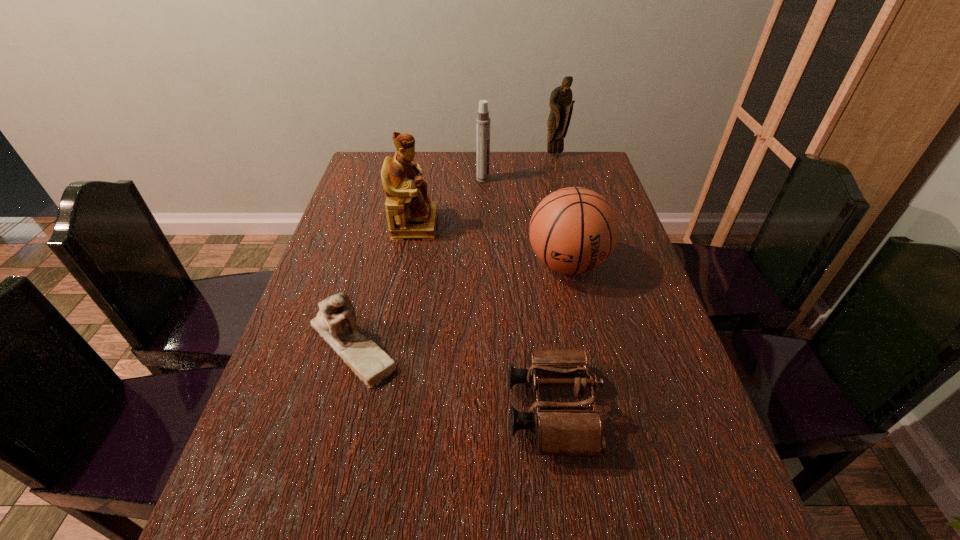
You are a GUI agent. You are given a task and a screenshot of the screen. Output one action in this format:
    pyautogui.click(x=<x>, y=<y>)
    Task: Click on the vacant space located on the front-facing side of the second farthest figurine
    
    Given the screenshot: What is the action you would take?
    pyautogui.click(x=457, y=224)

At what (x,y) coordinates should I click in order to perform the action: click on vacant space situated 0.170m on the left of the fourth object from right to left. Please return your answer as a coordinate pair (x, y). The image size is (960, 540). Looking at the image, I should click on (425, 179).

You are a GUI agent. You are given a task and a screenshot of the screen. Output one action in this format:
    pyautogui.click(x=<x>, y=<y>)
    Task: Click on the vacant space situated on the surface of the third shortest object near the brand logo
    The image size is (960, 540).
    Given the screenshot: What is the action you would take?
    pyautogui.click(x=607, y=447)

At what (x,y) coordinates should I click in order to perform the action: click on vacant position located on the front-facing side of the second shortest object. Please return your answer as a coordinate pair (x, y). This screenshot has width=960, height=540. Looking at the image, I should click on point(301,534).

Locate an element on the screen. Image resolution: width=960 pixels, height=540 pixels. free space located 0.400m through the eyepieces of the binoculars is located at coordinates (300, 410).

Locate an element on the screen. The height and width of the screenshot is (540, 960). vacant area located 0.370m through the eyepieces of the binoculars is located at coordinates (316, 410).

Identify the location of vacant space located 0.150m through the eyepieces of the binoculars. (431, 410).

Where is `figurine that is at the far edge`? figurine that is at the far edge is located at coordinates (561, 104).

You are a GUI agent. You are given a task and a screenshot of the screen. Output one action in this format:
    pyautogui.click(x=<x>, y=<y>)
    Task: Click on the aerosol can positioned at the far edge
    
    Given the screenshot: What is the action you would take?
    pyautogui.click(x=482, y=121)

Find the location of `object at the left edge`. object at the left edge is located at coordinates (335, 322).